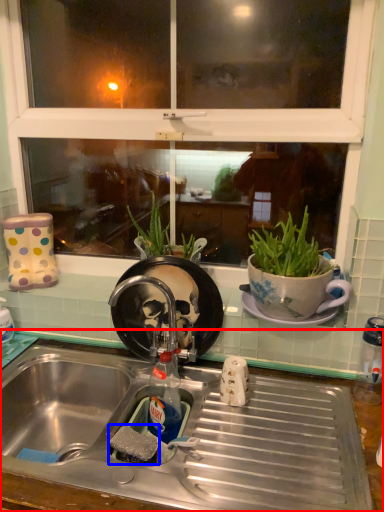
Question: Which object appears closest to the camera in this image, desk (highlighted by a red box) or food (highlighted by a blue box)?

Choices:
 (A) desk
 (B) food

Answer: (A)